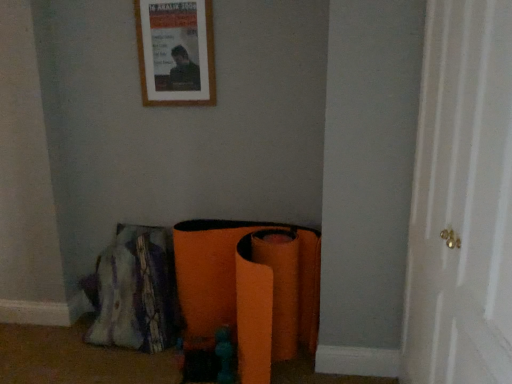
Find the location of `wooden picture frame at upper center`. wooden picture frame at upper center is located at coordinates (176, 52).

What do you see at coordinates (176, 52) in the screenshot? I see `wooden picture frame at upper center` at bounding box center [176, 52].

Measure the distance between wooden picture frame at upper center and camera.

A distance of 6.92 feet exists between wooden picture frame at upper center and camera.

What is the approximate height of wooden picture frame at upper center?

wooden picture frame at upper center is 21.31 inches tall.

Measure the distance between point (192, 101) and camera.

Point (192, 101) and camera are 2.22 meters apart.

What do you see at coordinates (462, 200) in the screenshot? I see `white wood door at right` at bounding box center [462, 200].

Locate an element on the screen. This screenshot has height=384, width=512. white wood door at right is located at coordinates (462, 200).

Consider the image. Measure the distance between point (444, 265) and camera.

They are 1.33 meters apart.

Find the location of a particular element. Image resolution: width=512 pixels, height=384 pixels. wooden picture frame at upper center is located at coordinates (176, 52).

In the scene shown: Can you confirm if white wood door at right is positioned to the left of wooden picture frame at upper center?

Incorrect, white wood door at right is not on the left side of wooden picture frame at upper center.

Is white wood door at right closer to camera compared to wooden picture frame at upper center?

Yes, white wood door at right is closer to the viewer.

Which point is more distant from viewer, (418, 356) or (152, 25)?

The point (152, 25) is more distant.

From the image's perspective, is white wood door at right located beneath wooden picture frame at upper center?

Correct, white wood door at right appears lower than wooden picture frame at upper center in the image.

From a real-world perspective, who is located higher, white wood door at right or wooden picture frame at upper center?

wooden picture frame at upper center, from a real-world perspective.

Considering the sizes of objects white wood door at right and wooden picture frame at upper center in the image provided, who is thinner, white wood door at right or wooden picture frame at upper center?

With smaller width is wooden picture frame at upper center.

Considering the relative sizes of white wood door at right and wooden picture frame at upper center in the image provided, is white wood door at right taller than wooden picture frame at upper center?

Yes, white wood door at right is taller than wooden picture frame at upper center.

Based on their sizes in the image, would you say white wood door at right is bigger or smaller than wooden picture frame at upper center?

In the image, white wood door at right appears to be larger than wooden picture frame at upper center.

Is white wood door at right not inside wooden picture frame at upper center?

Absolutely, white wood door at right is external to wooden picture frame at upper center.

Are white wood door at right and wooden picture frame at upper center located far from each other?

Indeed, white wood door at right is not near wooden picture frame at upper center.

Is white wood door at right positioned with its back to wooden picture frame at upper center?

No.

The image size is (512, 384). What are the coordinates of `door that appears below the wooden picture frame at upper center (from a real-world perspective)` in the screenshot? It's located at (462, 200).

Considering the relative positions of wooden picture frame at upper center and white wood door at right in the image provided, is wooden picture frame at upper center to the left of white wood door at right from the viewer's perspective?

Yes, wooden picture frame at upper center is to the left of white wood door at right.

Which is behind, wooden picture frame at upper center or white wood door at right?

wooden picture frame at upper center is further from the camera.

Considering the points (149, 78) and (443, 86), which point is in front, point (149, 78) or point (443, 86)?

The point (443, 86) is more forward.

From the image's perspective, which one is positioned lower, wooden picture frame at upper center or white wood door at right?

white wood door at right, from the image's perspective.

From a real-world perspective, who is located lower, wooden picture frame at upper center or white wood door at right?

From a 3D spatial view, white wood door at right is below.

Which of these two, wooden picture frame at upper center or white wood door at right, is thinner?

With smaller width is wooden picture frame at upper center.

From their relative heights in the image, would you say wooden picture frame at upper center is taller or shorter than white wood door at right?

Clearly, wooden picture frame at upper center is shorter compared to white wood door at right.

Does wooden picture frame at upper center have a smaller size compared to white wood door at right?

Yes.

Is wooden picture frame at upper center not within white wood door at right?

Yes.

Is wooden picture frame at upper center beside white wood door at right?

No, wooden picture frame at upper center is not next to white wood door at right.

Is wooden picture frame at upper center turned away from white wood door at right?

No, wooden picture frame at upper center is not facing the opposite direction of white wood door at right.

Can you tell me how much wooden picture frame at upper center and white wood door at right differ in facing direction?

90.1 degrees separate the facing orientations of wooden picture frame at upper center and white wood door at right.

How distant is wooden picture frame at upper center from white wood door at right?

wooden picture frame at upper center and white wood door at right are 1.29 meters apart from each other.

Locate an element on the screen. door that appears below the wooden picture frame at upper center (from the image's perspective) is located at coordinates (462, 200).

This screenshot has width=512, height=384. I want to click on door in front of the wooden picture frame at upper center, so click(462, 200).

At what (x,y) coordinates should I click in order to perform the action: click on door that appears below the wooden picture frame at upper center (from a real-world perspective). Please return your answer as a coordinate pair (x, y). Looking at the image, I should click on (462, 200).